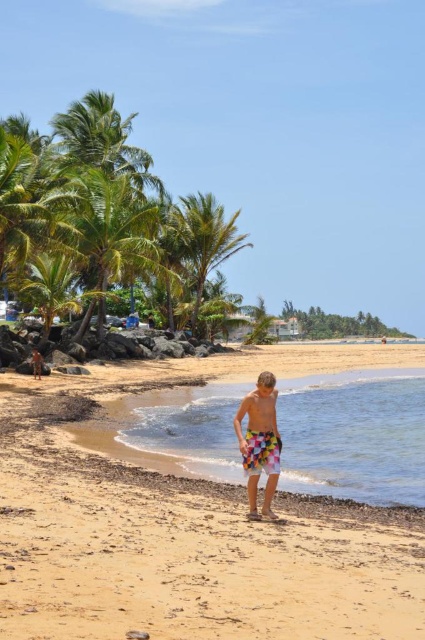
Question: Which object is the farthest from the colorful fabric shorts at center?

Choices:
 (A) green leafy palm tree at center
 (B) clear water at lower center
 (C) green leafy palm tree at upper left

Answer: (A)

Question: Observing the image, what is the correct spatial positioning of green leafy palm tree at upper left in reference to multicolored fabric shorts at center?

Choices:
 (A) below
 (B) above

Answer: (B)

Question: Is smooth golden sand at center to the right of colorful fabric shorts at center from the viewer's perspective?

Choices:
 (A) yes
 (B) no

Answer: (B)

Question: Which point is closer to the camera?

Choices:
 (A) smooth golden sand at center
 (B) green leafy palm tree at upper left

Answer: (A)

Question: Which of the following is the farthest from the observer?

Choices:
 (A) (252, 452)
 (B) (255, 403)
 (C) (11, 608)

Answer: (B)

Question: Does green leafy palm tree at center appear on the right side of colorful fabric shorts at center?

Choices:
 (A) yes
 (B) no

Answer: (B)